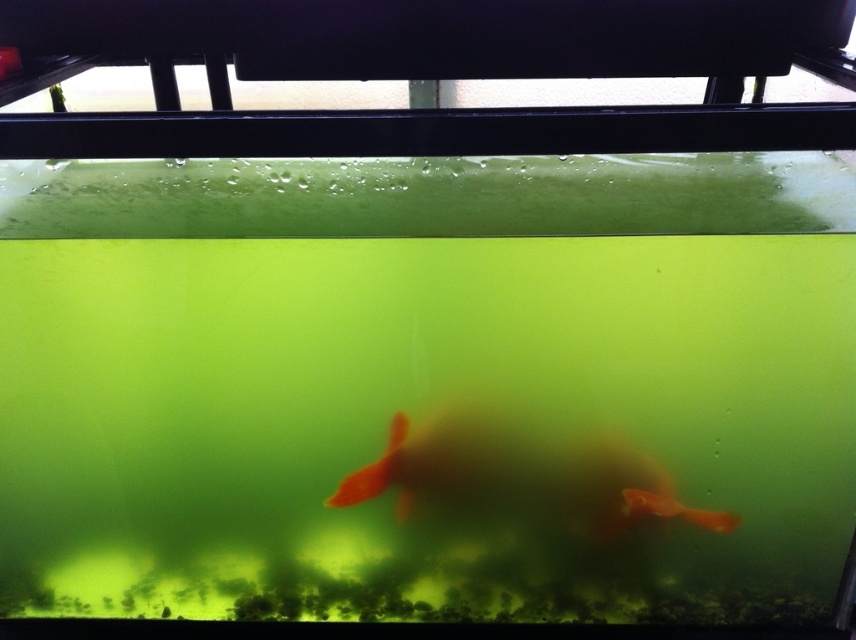
Measure the distance from translucent orange fish at center to orange matte goldfish at center.

translucent orange fish at center and orange matte goldfish at center are 5.67 inches apart.

Can you confirm if translucent orange fish at center is taller than orange matte goldfish at center?

Yes, translucent orange fish at center is taller than orange matte goldfish at center.

The height and width of the screenshot is (640, 856). Find the location of `translucent orange fish at center`. translucent orange fish at center is located at coordinates (514, 477).

Identify the location of translucent orange fish at center. (514, 477).